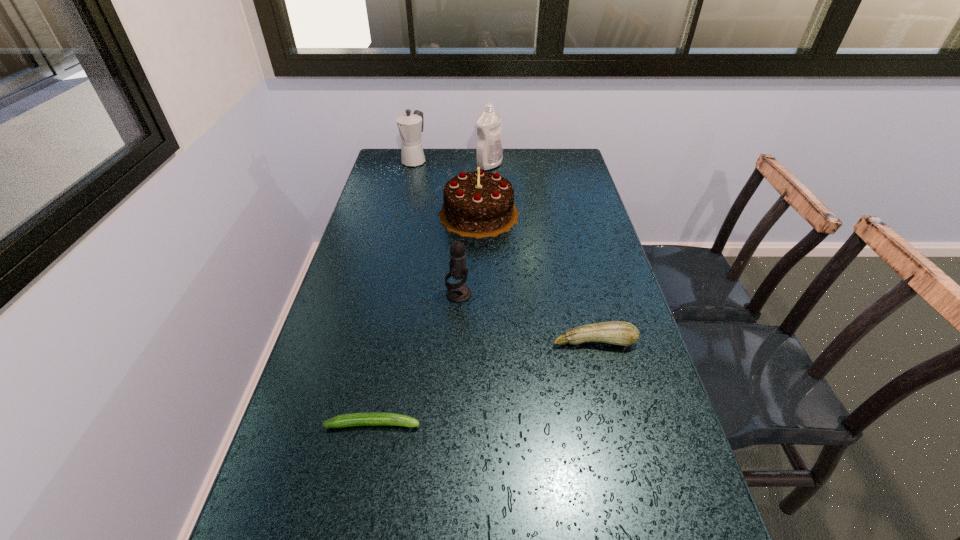
Where is `vacant space that's between the rightmost object and the shortest object`? Image resolution: width=960 pixels, height=540 pixels. vacant space that's between the rightmost object and the shortest object is located at coordinates (484, 382).

Find the location of a particular element. This screenshot has height=540, width=960. empty space that is in between the coffeepot and the taller zucchini is located at coordinates (504, 251).

Identify which object is the second closest to the birthday cake. Please provide its 2D coordinates. Your answer should be formatted as a tuple, i.e. [(x, y)], where the tuple contains the x and y coordinates of a point satisfying the conditions above.

[(410, 126)]

Select which object appears as the closest to the third farthest object. Please provide its 2D coordinates. Your answer should be formatted as a tuple, i.e. [(x, y)], where the tuple contains the x and y coordinates of a point satisfying the conditions above.

[(489, 153)]

Find the location of a particular element. Image resolution: width=960 pixels, height=540 pixels. zucchini that can be found as the closest to the coffeepot is located at coordinates (622, 333).

Locate which zucchini is the second closest to the detergent. Please provide its 2D coordinates. Your answer should be formatted as a tuple, i.e. [(x, y)], where the tuple contains the x and y coordinates of a point satisfying the conditions above.

[(366, 418)]

The height and width of the screenshot is (540, 960). I want to click on blank space that satisfies the following two spatial constraints: 1. at the stem end of the farther zucchini; 2. on the front-facing side of the shorter zucchini, so click(x=614, y=424).